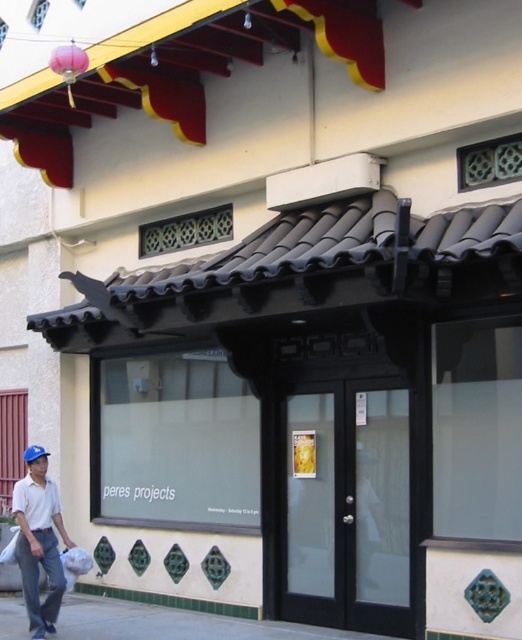
Question: Is smooth concrete pavement at lower center smaller than white matte shirt at lower left?

Choices:
 (A) yes
 (B) no

Answer: (B)

Question: Can you confirm if smooth concrete pavement at lower center is bigger than white matte shirt at lower left?

Choices:
 (A) yes
 (B) no

Answer: (A)

Question: Can you confirm if smooth concrete pavement at lower center is thinner than white matte shirt at lower left?

Choices:
 (A) yes
 (B) no

Answer: (B)

Question: Which of the following is the farthest from the observer?

Choices:
 (A) (201, 616)
 (B) (11, 509)

Answer: (B)